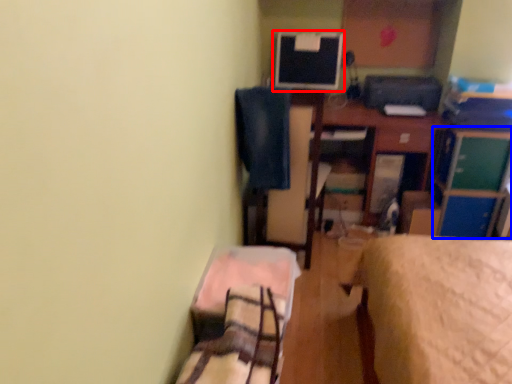
Question: Among these objects, which one is farthest to the camera, computer monitor (highlighted by a red box) or file cabinet (highlighted by a blue box)?

Choices:
 (A) computer monitor
 (B) file cabinet

Answer: (A)